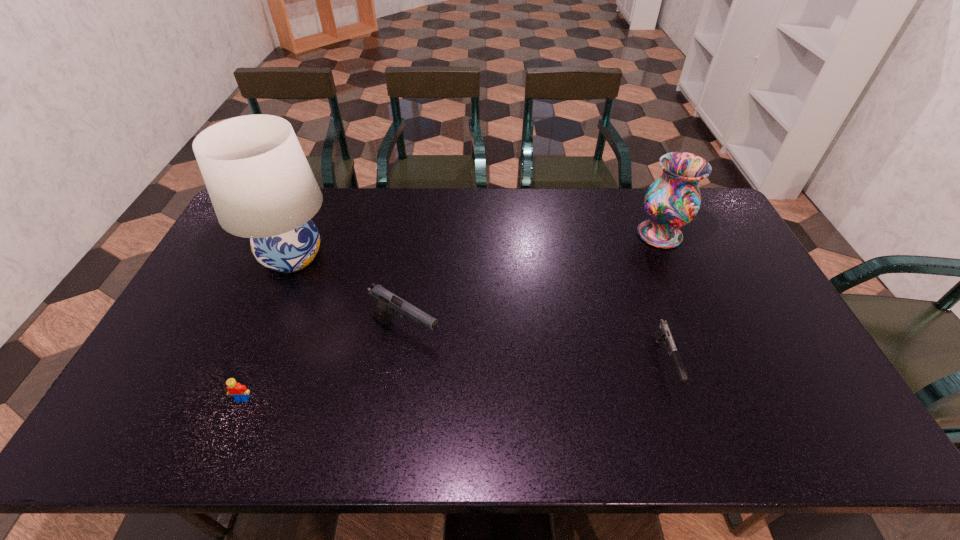
I want to click on vacant space at the near edge of the desktop, so click(481, 416).

The height and width of the screenshot is (540, 960). Find the location of `free space at the left edge of the desktop`. free space at the left edge of the desktop is located at coordinates (239, 305).

Find the location of a particular element. This screenshot has width=960, height=540. free space at the right edge is located at coordinates (712, 231).

The height and width of the screenshot is (540, 960). Find the location of `vacant space in between the lampshade and the left gun`. vacant space in between the lampshade and the left gun is located at coordinates (349, 296).

Where is `empty space between the rightmost object and the taller gun`? empty space between the rightmost object and the taller gun is located at coordinates (533, 285).

At what (x,y) coordinates should I click in order to perform the action: click on vacant area that lies between the left gun and the vase. Please return your answer as a coordinate pair (x, y). The width and height of the screenshot is (960, 540). Looking at the image, I should click on (533, 285).

Identify the location of blank region between the Lego and the vase. (451, 316).

Locate an element on the screen. Image resolution: width=960 pixels, height=540 pixels. empty space that is in between the vase and the lampshade is located at coordinates (476, 246).

You are a GUI agent. You are given a task and a screenshot of the screen. Output one action in this format:
    pyautogui.click(x=<x>, y=<y>)
    Task: Click on the empty location between the lampshade and the Lego
    The height and width of the screenshot is (540, 960).
    Given the screenshot: What is the action you would take?
    pyautogui.click(x=268, y=328)

This screenshot has height=540, width=960. Find the location of `free space that is in between the Lego and the vase`. free space that is in between the Lego and the vase is located at coordinates 451,316.